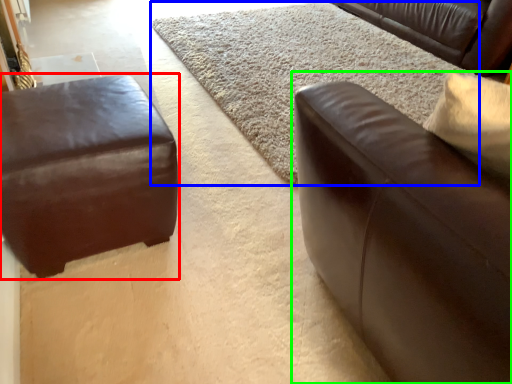
Question: Estimate the real-world distances between objects in this image. Which object is farther from studio couch (highlighted by a red box), mat (highlighted by a blue box) or studio couch (highlighted by a green box)?

Choices:
 (A) mat
 (B) studio couch

Answer: (A)